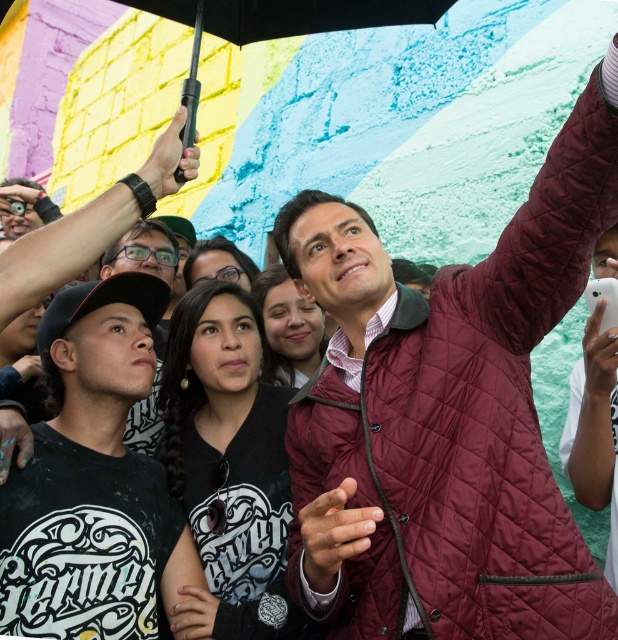
Question: Which object appears closest to the camera in this image?

Choices:
 (A) black matte umbrella at upper center
 (B) maroon quilted jacket at upper right

Answer: (B)

Question: Can you confirm if maroon quilted jacket at upper right is bigger than burgundy quilted jacket at upper right?

Choices:
 (A) yes
 (B) no

Answer: (A)

Question: Considering the real-world distances, which object is farthest from the black matte umbrella at upper center?

Choices:
 (A) maroon quilted jacket at upper right
 (B) black printed t-shirt at lower left
 (C) burgundy quilted jacket at upper right

Answer: (C)

Question: Can you confirm if black printed t-shirt at lower left is positioned below burgundy quilted jacket at upper right?

Choices:
 (A) yes
 (B) no

Answer: (A)

Question: Does maroon quilted jacket at upper right come in front of black printed t-shirt at lower left?

Choices:
 (A) no
 (B) yes

Answer: (B)

Question: Which object is closer to the camera taking this photo?

Choices:
 (A) maroon quilted jacket at upper right
 (B) black matte umbrella at upper center
 (C) black printed t-shirt at lower left
 (D) burgundy quilted jacket at upper right

Answer: (A)